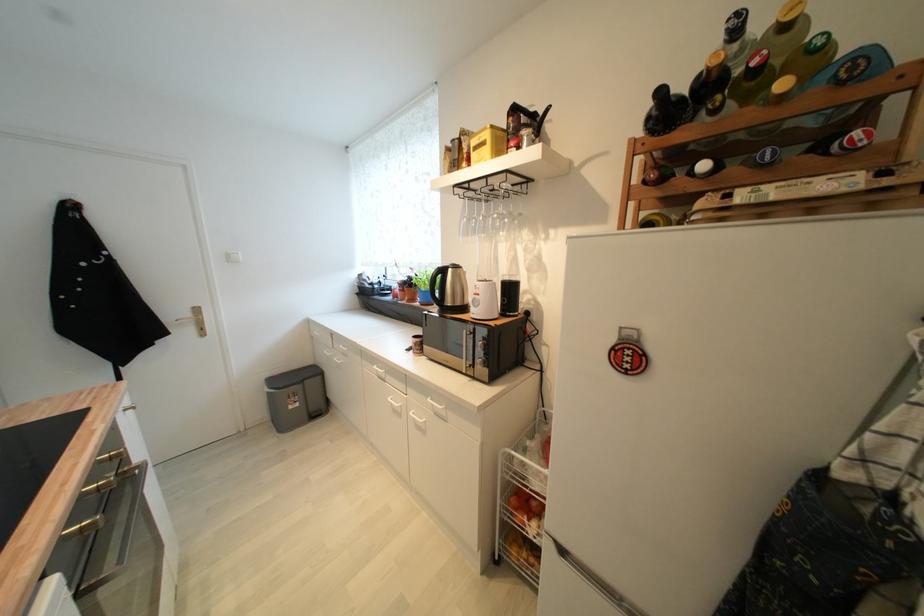
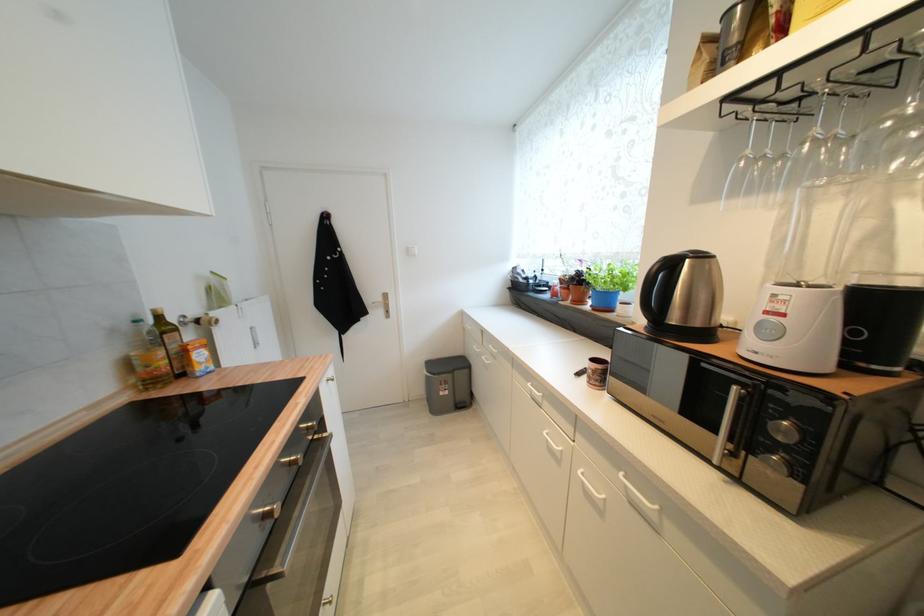
Question: The images are taken continuously from a first-person perspective. In which direction is your viewpoint rotating?

Choices:
 (A) Left
 (B) Right
 (C) Up
 (D) Down

Answer: (A)